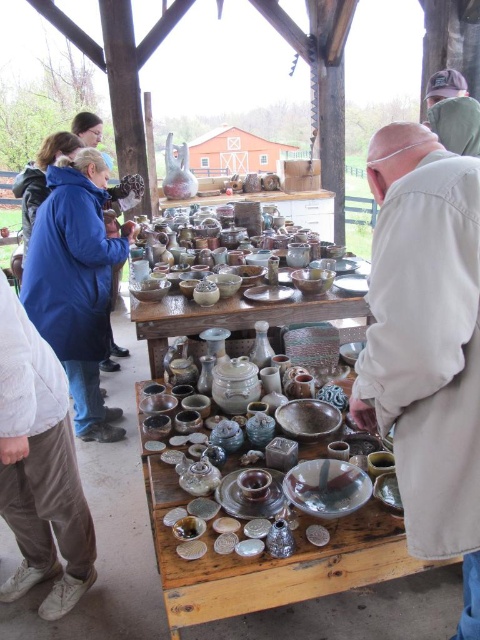
Who is lower down, beige fabric shirt at right or green fabric cap at upper right?

beige fabric shirt at right is lower down.

Is beige fabric shirt at right in front of green fabric cap at upper right?

Yes, beige fabric shirt at right is closer to the viewer.

Does point (467, 454) come in front of point (478, 156)?

Yes, it is in front of point (478, 156).

This screenshot has width=480, height=640. I want to click on beige fabric shirt at right, so click(x=427, y=342).

Is beige fabric shirt at right below glossy ceramic bowls at center?

Yes.

Does beige fabric shirt at right lie behind glossy ceramic bowls at center?

No, it is not.

Which is behind, point (460, 406) or point (240, 232)?

The point (240, 232) is more distant.

The width and height of the screenshot is (480, 640). What are the coordinates of `beige fabric shirt at right` in the screenshot? It's located at (427, 342).

Does glossy ceramic bowls at center have a smaller size compared to green fabric cap at upper right?

No.

Is glossy ceramic bowls at center to the left of green fabric cap at upper right from the viewer's perspective?

Yes, glossy ceramic bowls at center is to the left of green fabric cap at upper right.

Who is more forward, (303, 291) or (460, 138)?

Point (460, 138) is more forward.

This screenshot has width=480, height=640. Find the location of `glossy ceramic bowls at center`. glossy ceramic bowls at center is located at coordinates (345, 268).